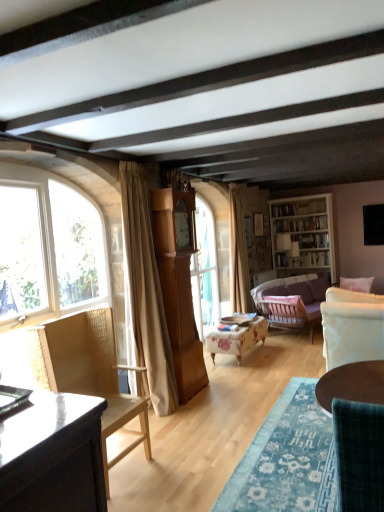
Question: From the image's perspective, would you say floral fabric ottoman at center, the 1th chair in the back-to-front sequence, is shown under light brown wood grandfather clock at center?

Choices:
 (A) yes
 (B) no

Answer: (A)

Question: Is floral fabric ottoman at center, positioned as the 2th chair in right-to-left order, to the left of light brown wood grandfather clock at center from the viewer's perspective?

Choices:
 (A) yes
 (B) no

Answer: (B)

Question: Is floral fabric ottoman at center, the 2th chair in the left-to-right sequence, turned away from light brown wood grandfather clock at center?

Choices:
 (A) no
 (B) yes

Answer: (A)

Question: Is floral fabric ottoman at center, which is counted as the 3th chair, starting from the front, at the right side of light brown wood grandfather clock at center?

Choices:
 (A) yes
 (B) no

Answer: (A)

Question: From the image's perspective, is floral fabric ottoman at center, positioned as the 2th chair in right-to-left order, on top of light brown wood grandfather clock at center?

Choices:
 (A) yes
 (B) no

Answer: (B)

Question: Looking at their shapes, would you say light brown wood grandfather clock at center is wider or thinner than beige fabric curtain at center, placed as the 1th curtain when sorted from back to front?

Choices:
 (A) thin
 (B) wide

Answer: (B)

Question: Considering the positions of light brown wood grandfather clock at center and beige fabric curtain at center, which is the 1th curtain from right to left, in the image, is light brown wood grandfather clock at center bigger or smaller than beige fabric curtain at center, which is the 1th curtain from right to left,?

Choices:
 (A) big
 (B) small

Answer: (A)

Question: Visually, is light brown wood grandfather clock at center positioned to the left or to the right of beige fabric curtain at center, which is the 1th curtain from right to left?

Choices:
 (A) left
 (B) right

Answer: (A)

Question: From the image's perspective, relative to beige fabric curtain at center, the 2th curtain viewed from the front, is light brown wood grandfather clock at center above or below?

Choices:
 (A) above
 (B) below

Answer: (B)

Question: From a real-world perspective, is light brown wood grandfather clock at center above or below woven wood chair at left, marked as the second chair in a back-to-front arrangement?

Choices:
 (A) below
 (B) above

Answer: (B)

Question: Considering the positions of point (178, 230) and point (74, 373), is point (178, 230) closer or farther from the camera than point (74, 373)?

Choices:
 (A) farther
 (B) closer

Answer: (A)

Question: Considering the positions of light brown wood grandfather clock at center and woven wood chair at left, which appears as the third chair when viewed from the right, in the image, is light brown wood grandfather clock at center wider or thinner than woven wood chair at left, which appears as the third chair when viewed from the right,?

Choices:
 (A) thin
 (B) wide

Answer: (A)

Question: Is light brown wood grandfather clock at center bigger or smaller than woven wood chair at left, which ranks as the second chair in front-to-back order?

Choices:
 (A) small
 (B) big

Answer: (A)

Question: In the image, is clear glass window at left on the left side or the right side of beige fabric curtain at left, placed as the second curtain when sorted from right to left?

Choices:
 (A) right
 (B) left

Answer: (B)

Question: From the image's perspective, is clear glass window at left located above or below beige fabric curtain at left, placed as the second curtain when sorted from right to left?

Choices:
 (A) above
 (B) below

Answer: (A)